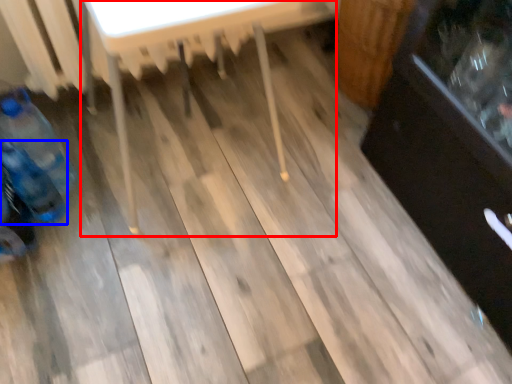
Question: Which of the following is the farthest to the observer, table (highlighted by a red box) or bottle (highlighted by a blue box)?

Choices:
 (A) table
 (B) bottle

Answer: (B)